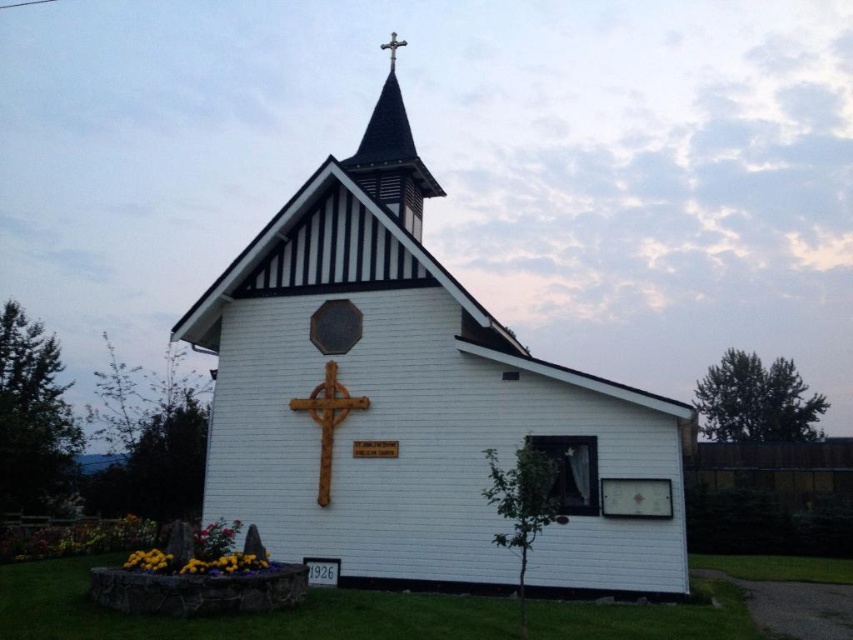
You are standing in front of the church and want to place a new flower pot between the two points, point [334,365] and point [393,51]. Which point should the flower pot be closer to if you want it to appear larger in the photo?

The flower pot should be placed closer to point [334,365] because it is closer to the camera, making objects placed there appear larger in the photo.

You are standing in front of the church and want to place a new decoration between the black wood spire at upper center and the rusty wood crucifix at center. Where should you place it so it is between them?

The black wood spire at upper center is located above the rusty wood crucifix at center, so placing the new decoration between them would require positioning it below the black wood spire at upper center and above the rusty wood crucifix at center.